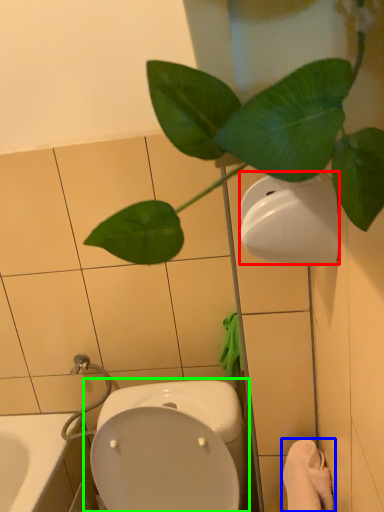
Question: Which object is positioned closest to toilet paper (highlighted by a red box)? Select from bath towel (highlighted by a blue box) and toilet (highlighted by a green box).

Choices:
 (A) bath towel
 (B) toilet

Answer: (A)